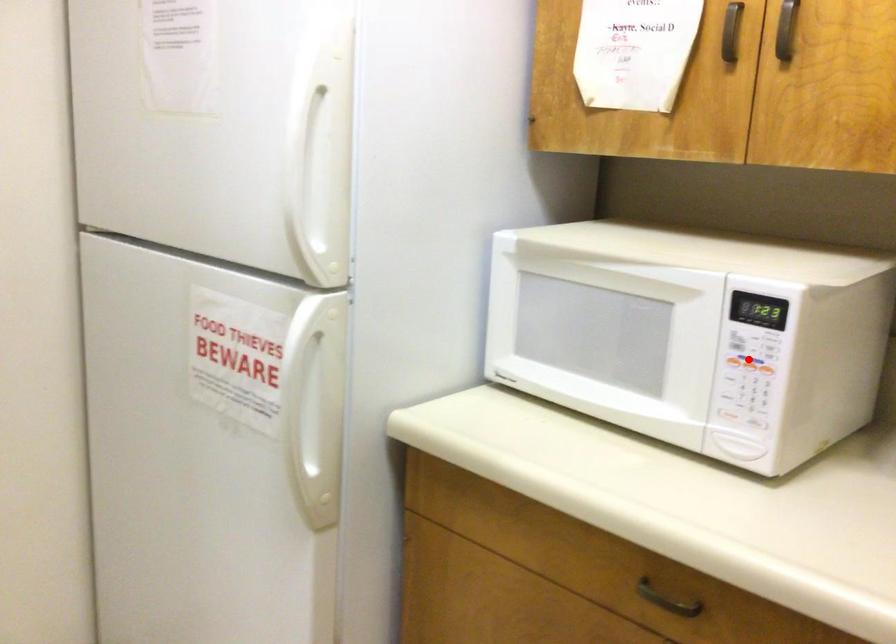
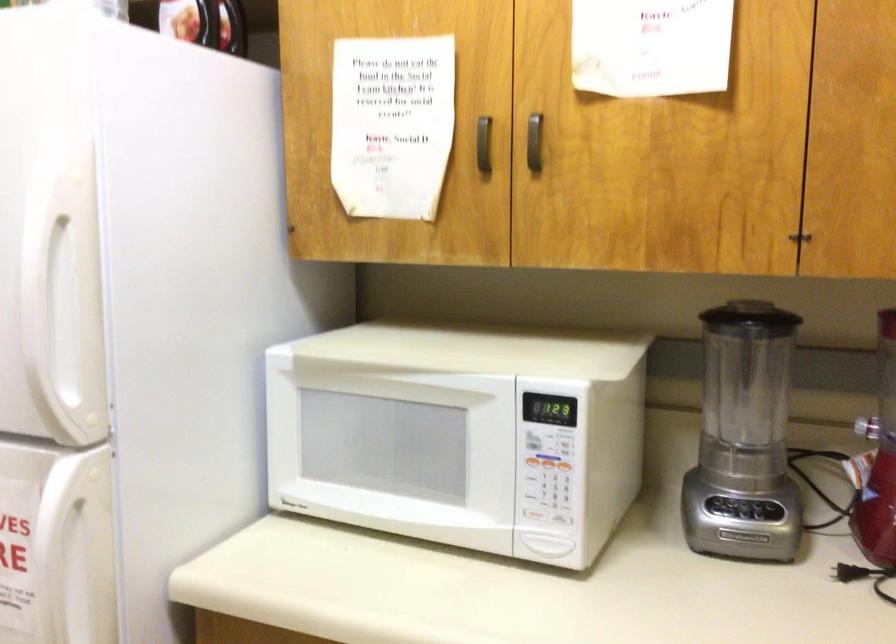
In the second image, find the point that corresponds to the highlighted location in the first image.

(547, 462)